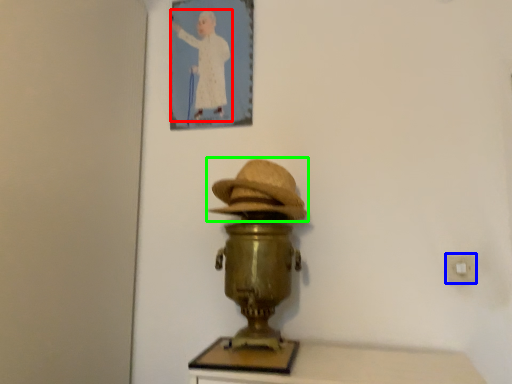
Question: Considering the real-world distances, which object is closest to person (highlighted by a red box)? electric outlet (highlighted by a blue box) or hat (highlighted by a green box).

Choices:
 (A) electric outlet
 (B) hat

Answer: (B)